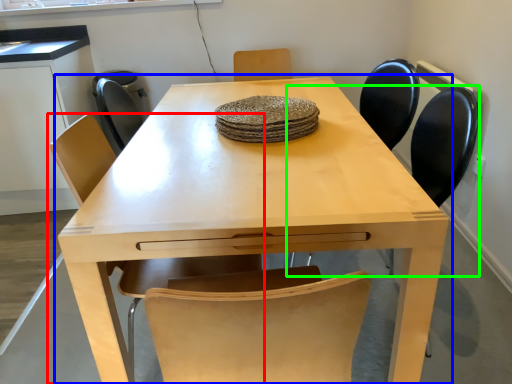
Question: Which is nearer to the chair (highlighted by a red box)? table (highlighted by a blue box) or chair (highlighted by a green box).

Choices:
 (A) table
 (B) chair

Answer: (A)